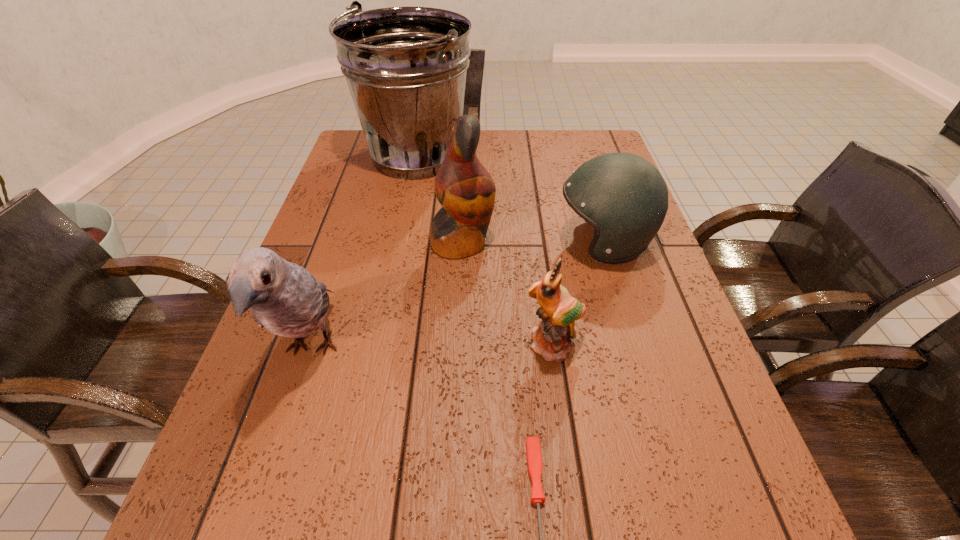
Where is `vacant region that satisfies the following two spatial constraints: 1. at the face opening of the football helmet; 2. on the front-facing side of the rightmost parrot`? The image size is (960, 540). vacant region that satisfies the following two spatial constraints: 1. at the face opening of the football helmet; 2. on the front-facing side of the rightmost parrot is located at coordinates (636, 346).